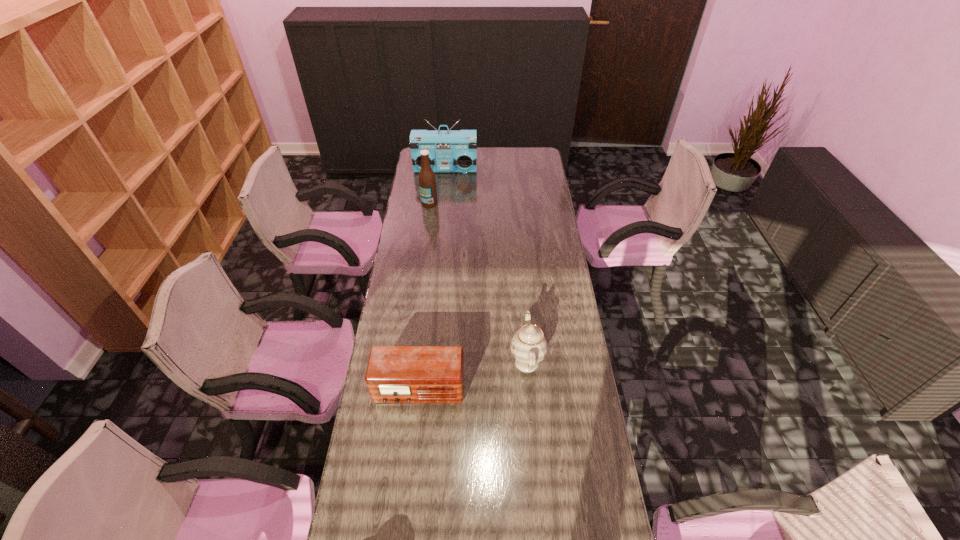
Find the location of `the farthest object`. the farthest object is located at coordinates (449, 150).

Locate an element on the screen. This screenshot has width=960, height=540. the farther radio receiver is located at coordinates click(x=449, y=150).

This screenshot has width=960, height=540. I want to click on beer bottle, so click(427, 182).

Identify the location of the third tallest object. The height and width of the screenshot is (540, 960). (528, 346).

You are a GUI agent. You are given a task and a screenshot of the screen. Output one action in this format:
    pyautogui.click(x=<x>, y=<y>)
    Task: Click on the rightmost object
    
    Given the screenshot: What is the action you would take?
    pyautogui.click(x=528, y=346)

The image size is (960, 540). What are the coordinates of `the shortest object` in the screenshot? It's located at (395, 374).

Where is `the shorter radio receiver`? the shorter radio receiver is located at coordinates (395, 374).

Where is `free space located 0.350m on the front-facing side of the farther radio receiver`? The image size is (960, 540). free space located 0.350m on the front-facing side of the farther radio receiver is located at coordinates (442, 215).

Locate an element on the screen. The image size is (960, 540). vacant space located on the front of the third nearest object is located at coordinates (421, 264).

Locate an element on the screen. This screenshot has height=540, width=960. vacant point located 0.190m on the spout of the chinaware is located at coordinates (457, 362).